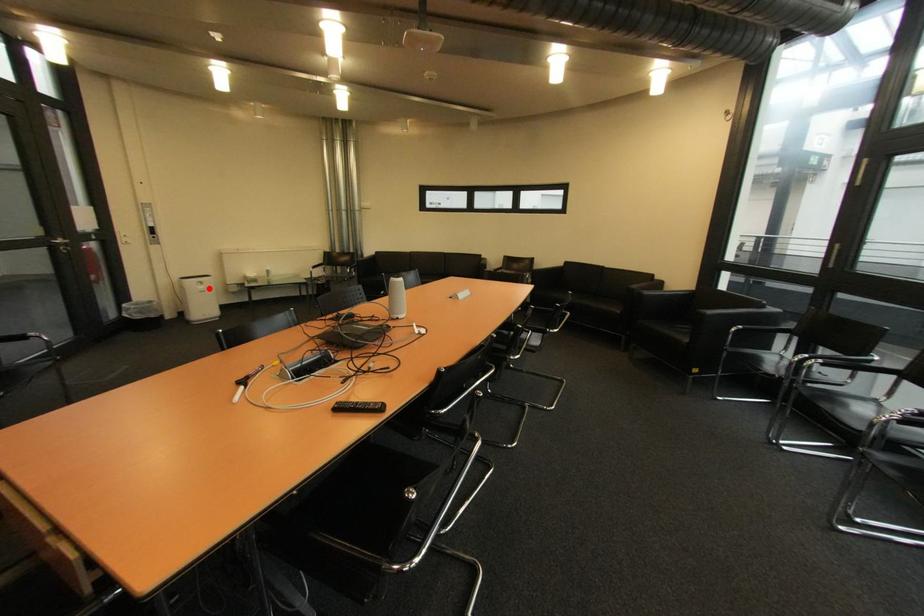
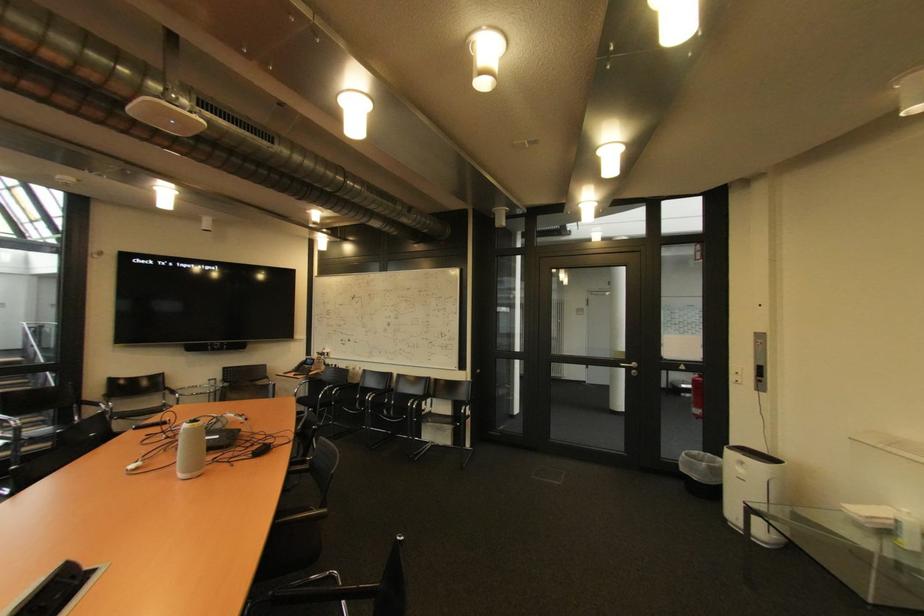
Where in the second image is the point corresponding to the highlighted location from the first image?

(748, 471)